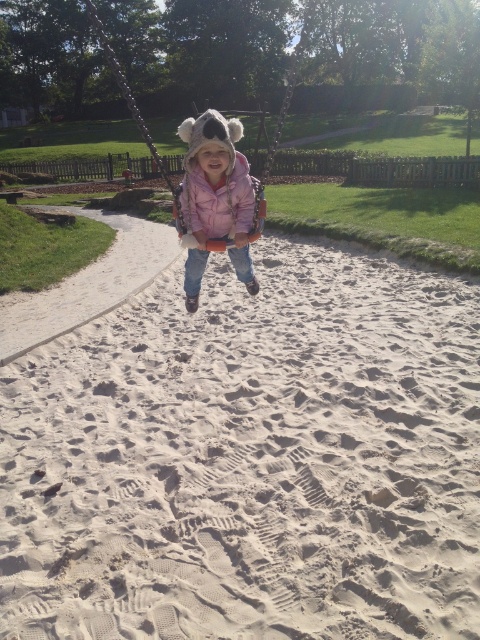
You are a parent at the playground and want to check if your child is sitting on the sand. Based on the image, is the smooth sand at center located under the pink fuzzy coat at center?

Yes, the smooth sand at center is positioned under pink fuzzy coat at center, so the child is sitting on the sand.

From the picture: You are a parent at the playground and see your child wearing a pink fuzzy coat at center and a pink fleece jacket at center. Which piece of clothing is higher on the child?

The pink fuzzy coat at center is above the pink fleece jacket at center, so the pink fuzzy coat at center is higher on the child.

You are a parent trying to dress your child for a cold day. You have two options in the image, a pink fuzzy coat at center and a pink fleece jacket at center. Which one would be more suitable for keeping the child warm based on their size?

The pink fuzzy coat at center has a larger size compared to the pink fleece jacket at center, making it more suitable for keeping the child warm as larger coats generally provide better insulation and coverage.